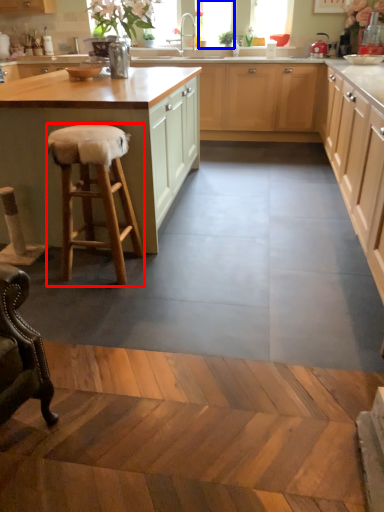
Question: Which object appears farthest to the camera in this image, stool (highlighted by a red box) or window screen (highlighted by a blue box)?

Choices:
 (A) stool
 (B) window screen

Answer: (B)